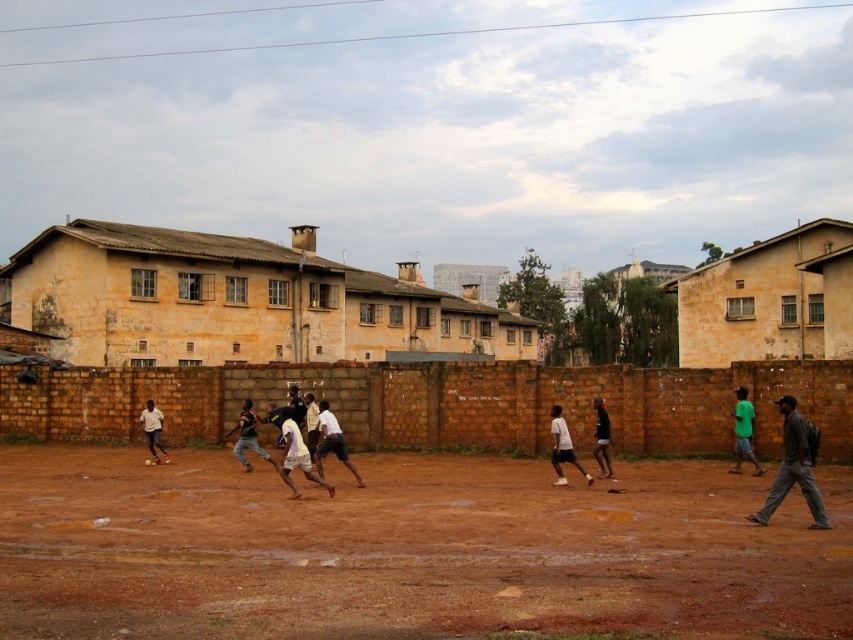
You are a photographer trying to capture a shot of the white matte shirt at center without the dark gray fabric backpack at lower right blocking the view. Based on their positions and sizes, is the backpack likely to obstruct the shirt in your photo?

The dark gray fabric backpack at lower right might be wider than the white matte shirt at center, so there is a possibility that the backpack could obstruct the shirt in your photo depending on the angle and distance.